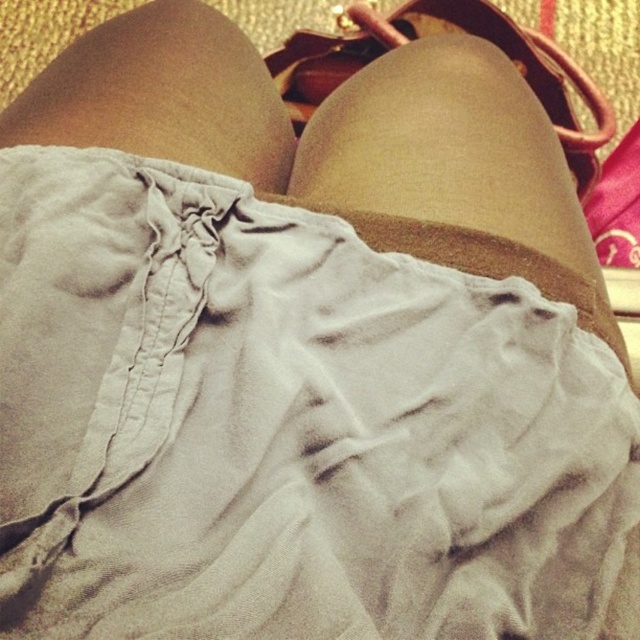
You are trying to determine if the matte beige shorts at center can fully cover the matte brown shoe at upper center. Based on their positions and sizes, what do you think?

The matte beige shorts at center is not as tall as matte brown shoe at upper center, so the shorts cannot fully cover the shoe since it is shorter in height.

You are trying to locate the matte beige shorts at center in the image. According to the coordinates provided, where exactly would you find them?

The matte beige shorts at center are located at point coordinates of (163,96).